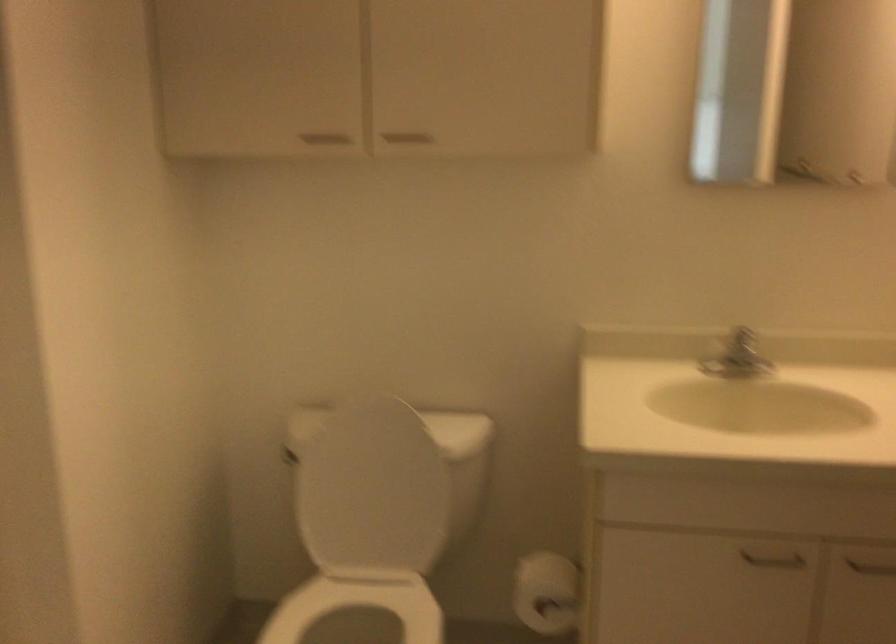
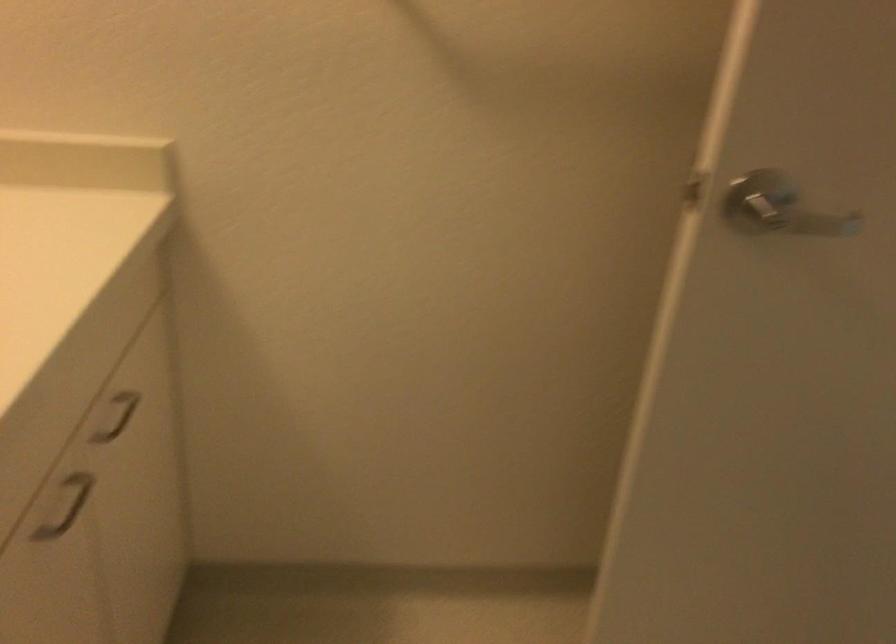
Question: I am providing you with two images of the same scene from different viewpoints. After the viewpoint changes to image2, which objects are now occluded?

Choices:
 (A) eyewash station lever
 (B) white cabinet handle
 (C) silver door handle
 (D) cabinet handle

Answer: (D)